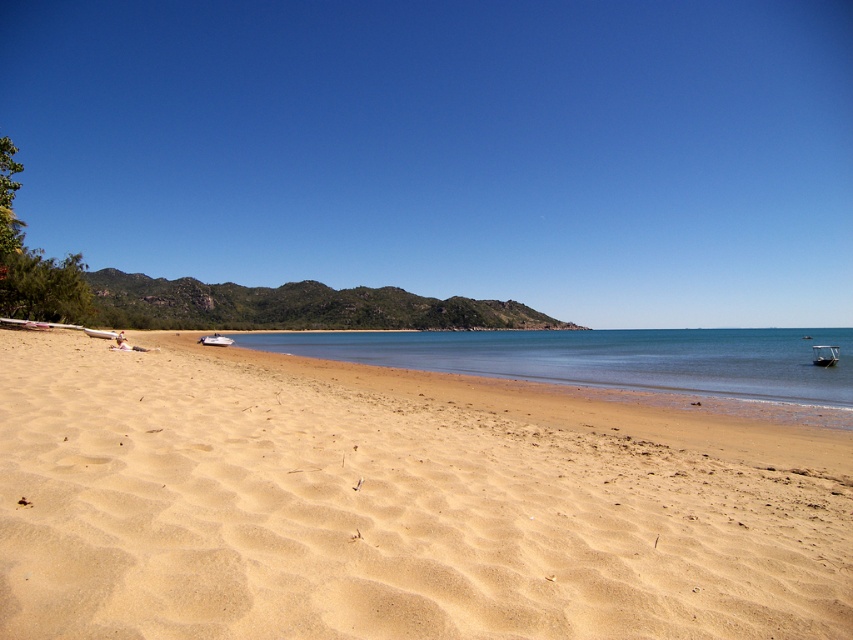
Question: Does sandy beach at lower left have a smaller size compared to clear blue water at center?

Choices:
 (A) yes
 (B) no

Answer: (A)

Question: Can you confirm if clear blue water at center is positioned below white plastic boat at lower left?

Choices:
 (A) yes
 (B) no

Answer: (A)

Question: Considering the real-world distances, which object is farthest from the white plastic boat at center?

Choices:
 (A) clear blue water at center
 (B) metallic silver boat at lower right
 (C) white plastic boat at lower left

Answer: (A)

Question: Which point is farther to the camera?

Choices:
 (A) metallic silver boat at lower right
 (B) sandy beach at lower left
 (C) white plastic boat at center

Answer: (C)

Question: Which point is closer to the camera taking this photo?

Choices:
 (A) (611, 611)
 (B) (352, 358)
 (C) (207, 340)
 (D) (820, 356)

Answer: (A)

Question: Does metallic silver boat at lower right appear on the right side of white plastic boat at lower left?

Choices:
 (A) no
 (B) yes

Answer: (B)